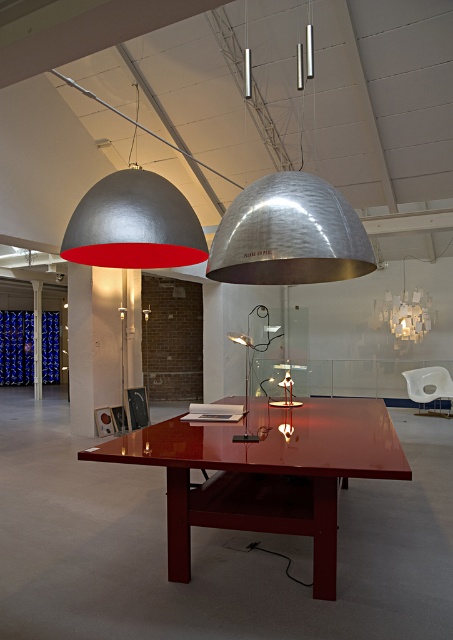
Question: Which point is farther to the camera?

Choices:
 (A) (67, 237)
 (B) (439, 392)

Answer: (B)

Question: Which object is positioned closest to the white plastic chair at center?

Choices:
 (A) metallic dome lamp at upper center
 (B) white paper lampshade at upper center
 (C) silver hammered metal dome at upper center
 (D) glossy wood table at center

Answer: (B)

Question: Which is nearer to the silver hammered metal dome at upper center?

Choices:
 (A) metallic dome-shaped light fixture at upper center
 (B) white paper lampshade at upper center
 (C) white plastic chair at center

Answer: (A)

Question: Is glossy wood table at center wider than metallic dome-shaped light fixture at upper center?

Choices:
 (A) no
 (B) yes

Answer: (B)

Question: Can you confirm if glossy wood table at center is wider than metallic dome lamp at upper center?

Choices:
 (A) no
 (B) yes

Answer: (B)

Question: Does silver hammered metal dome at upper center have a lesser width compared to white paper lampshade at upper center?

Choices:
 (A) no
 (B) yes

Answer: (B)